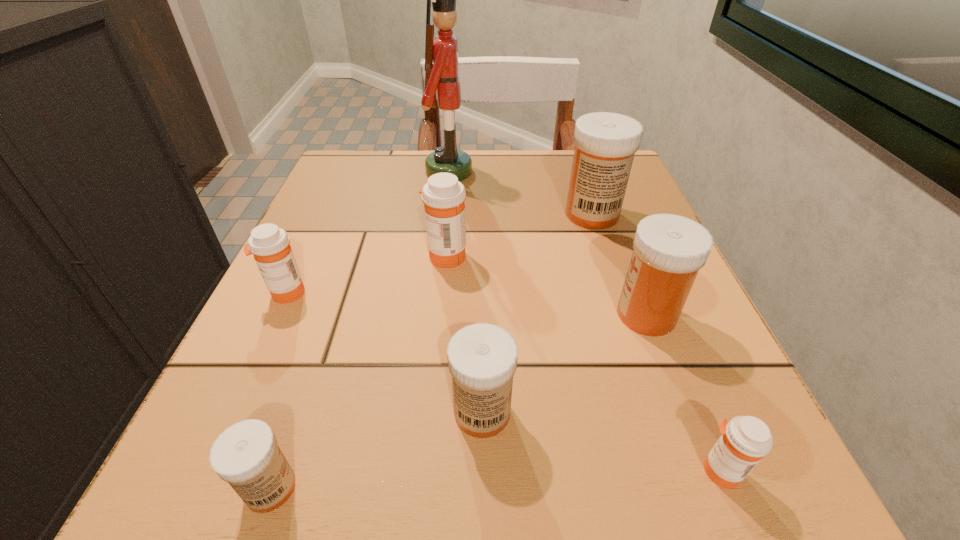
Where is `vacant region located 0.130m on the left of the fifth farthest medicine`? vacant region located 0.130m on the left of the fifth farthest medicine is located at coordinates (346, 412).

Locate an element on the screen. This screenshot has height=540, width=960. free space located on the back of the rightmost orange medicine is located at coordinates (648, 293).

Locate an element on the screen. vacant region located 0.140m on the back of the leftmost white medicine is located at coordinates (314, 361).

Locate an element on the screen. nutcracker that is at the far edge is located at coordinates (441, 53).

Where is `medicine present at the far edge`? medicine present at the far edge is located at coordinates tap(605, 143).

You are a GUI agent. You are given a task and a screenshot of the screen. Output one action in this format:
    pyautogui.click(x=<x>, y=<y>)
    Task: Click on the object at the near left corner
    
    Given the screenshot: What is the action you would take?
    pyautogui.click(x=246, y=455)

This screenshot has width=960, height=540. What are the coordinates of `object at the far right corner` in the screenshot? It's located at (605, 143).

This screenshot has height=540, width=960. I want to click on object that is at the near right corner, so click(745, 440).

In the image, there is a desktop. In order to click on vacant region at the far edge in this screenshot , I will do `click(473, 206)`.

At what (x,y) coordinates should I click in order to perform the action: click on free location at the near edge of the desktop. Please return your answer as a coordinate pair (x, y). This screenshot has width=960, height=540. Looking at the image, I should click on (585, 483).